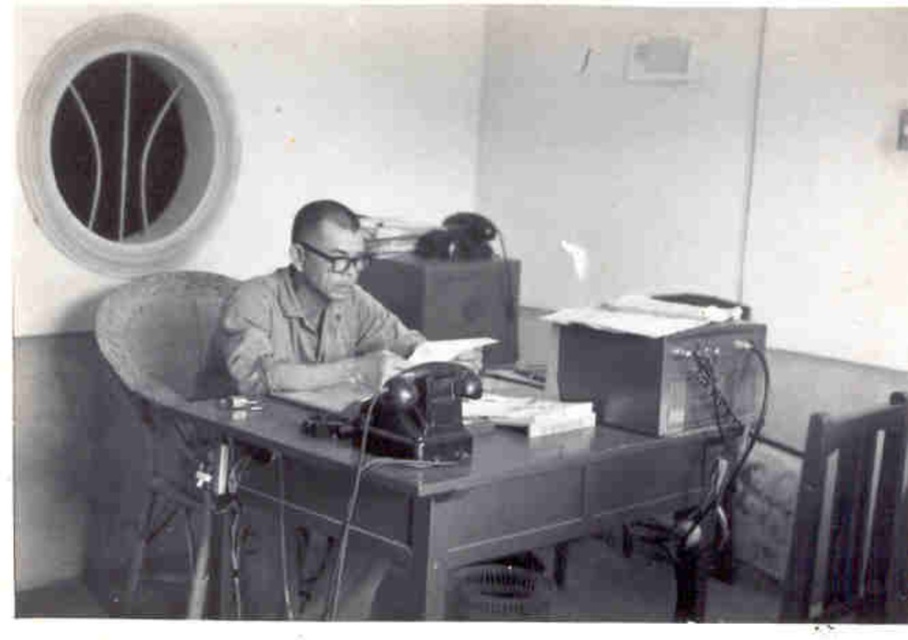
Between wooden chair at left and metallic wireframe chair at lower right, which one has less height?

metallic wireframe chair at lower right

Is wooden chair at left bigger than metallic wireframe chair at lower right?

Yes.

Which is behind, point (117, 294) or point (691, 557)?

Positioned behind is point (117, 294).

You are a GUI agent. You are given a task and a screenshot of the screen. Output one action in this format:
    pyautogui.click(x=<x>, y=<y>)
    Task: Click on the wooden chair at left
    Image resolution: width=908 pixels, height=640 pixels.
    Given the screenshot: What is the action you would take?
    pyautogui.click(x=181, y=420)

Can you confirm if metallic gray table at center is positioned to the left of matte khaki shirt at center?

No, metallic gray table at center is not to the left of matte khaki shirt at center.

Is point (484, 474) farther from viewer compared to point (351, 365)?

No, (484, 474) is in front of (351, 365).

Where is `metallic gray table at center`? This screenshot has width=908, height=640. metallic gray table at center is located at coordinates (457, 492).

Is matte khaki shirt at center closer to the viewer compared to wooden chair at right?

No, it is not.

Is matte khaki shirt at center to the right of wooden chair at right from the viewer's perspective?

Incorrect, matte khaki shirt at center is not on the right side of wooden chair at right.

Describe the element at coordinates (311, 312) in the screenshot. This screenshot has width=908, height=640. I see `matte khaki shirt at center` at that location.

In order to click on matte khaki shirt at center in this screenshot , I will do `click(311, 312)`.